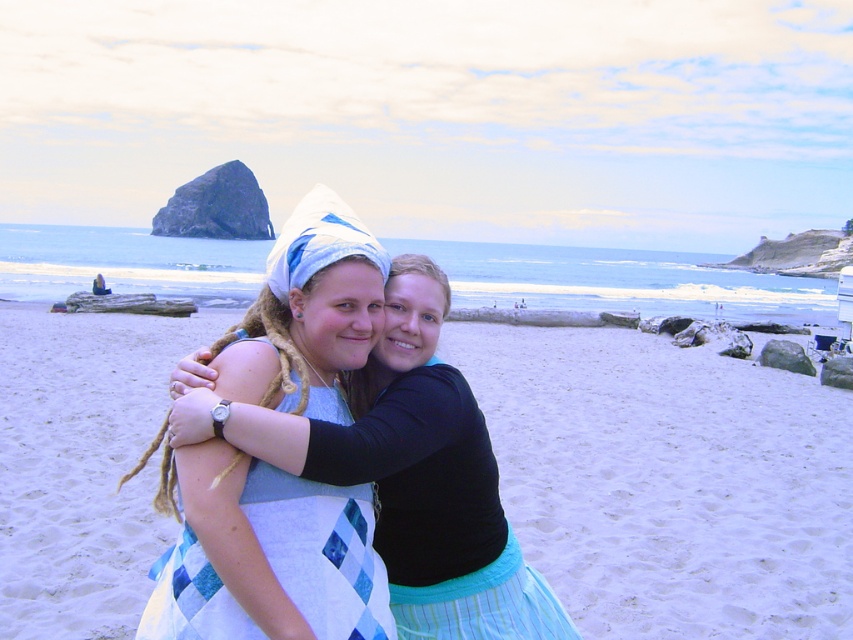
Is white sand at center below blue diamond-patterned fabric dress at center?

Actually, white sand at center is above blue diamond-patterned fabric dress at center.

Is point (706, 554) less distant than point (305, 508)?

No, (706, 554) is behind (305, 508).

What are the coordinates of `white sand at center` in the screenshot? It's located at (668, 481).

The width and height of the screenshot is (853, 640). Describe the element at coordinates (668, 481) in the screenshot. I see `white sand at center` at that location.

Is point (561, 432) farther from camera compared to point (450, 566)?

That is True.

Between point (801, 554) and point (383, 468), which one is positioned in front?

Positioned in front is point (383, 468).

Find the location of a particular element. white sand at center is located at coordinates pyautogui.click(x=668, y=481).

Between quilted fabric dress at center and blue diamond-patterned fabric dress at center, which one has less height?

blue diamond-patterned fabric dress at center is shorter.

Identify the location of quilted fabric dress at center. (419, 477).

This screenshot has height=640, width=853. Identify the location of quilted fabric dress at center. (419, 477).